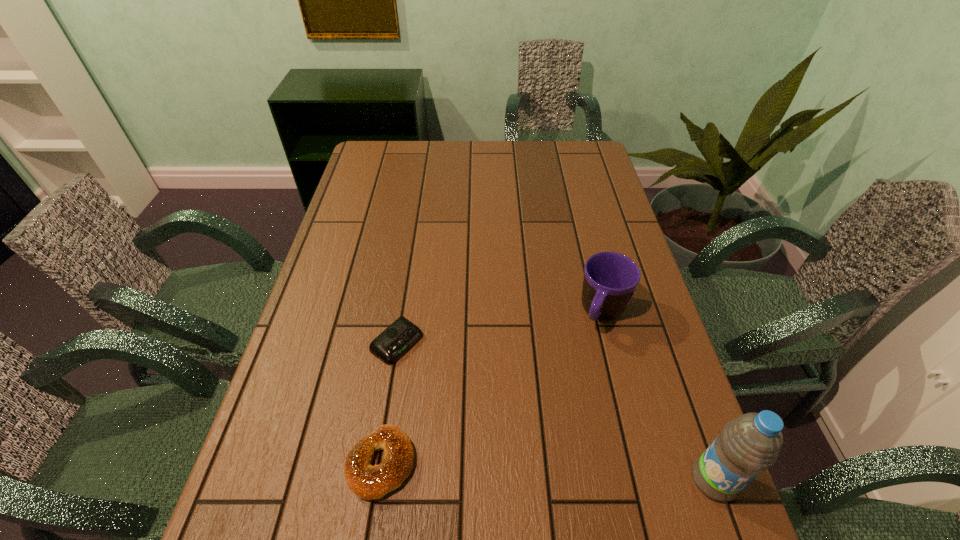
Image resolution: width=960 pixels, height=540 pixels. Find the location of `free space on the desktop that is between the third tallest object and the rightmost object and is positioned with the handle on the side of the mug`. free space on the desktop that is between the third tallest object and the rightmost object and is positioned with the handle on the side of the mug is located at coordinates (528, 470).

At what (x,y) coordinates should I click in order to perform the action: click on vacant space on the desktop that is between the bagel and the tallest object and is positioned on the display of the shortest object. Please return your answer as a coordinate pair (x, y). The image size is (960, 540). Looking at the image, I should click on (584, 474).